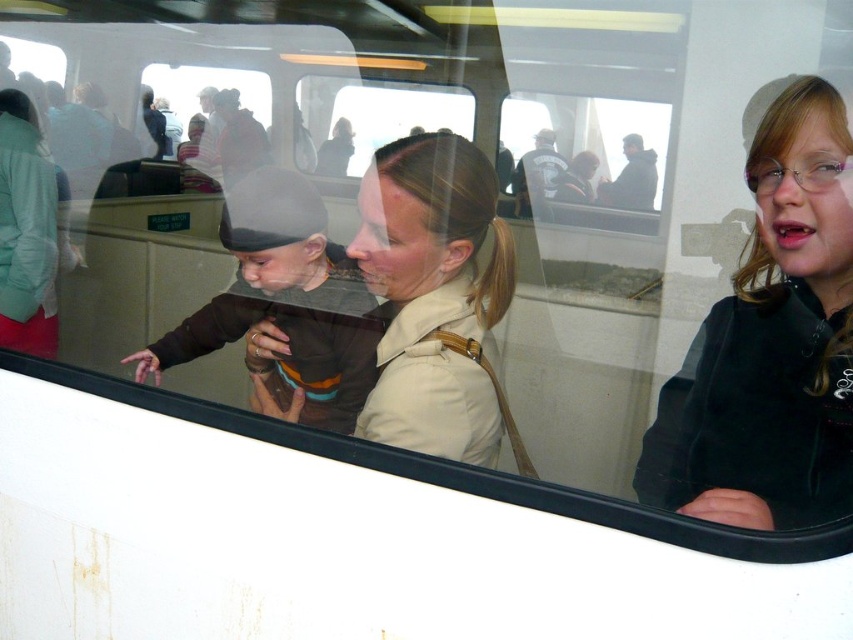
Question: Among these objects, which one is nearest to the camera?

Choices:
 (A) beige leather jacket at center
 (B) black matte jacket at right

Answer: (B)

Question: Does matte brown hat at left appear under dark blue leather jacket at center?

Choices:
 (A) yes
 (B) no

Answer: (A)

Question: Among these objects, which one is nearest to the camera?

Choices:
 (A) matte brown hat at left
 (B) dark blue leather jacket at center
 (C) black matte jacket at right

Answer: (C)

Question: Which of the following is the farthest from the observer?

Choices:
 (A) dark gray jacket at upper center
 (B) matte brown hat at left
 (C) beige leather jacket at center
 (D) dark blue leather jacket at center

Answer: (D)

Question: Where is beige leather jacket at center located in relation to matte brown hat at left in the image?

Choices:
 (A) left
 (B) right

Answer: (B)

Question: Does beige leather jacket at center appear on the right side of dark blue leather jacket at center?

Choices:
 (A) yes
 (B) no

Answer: (B)